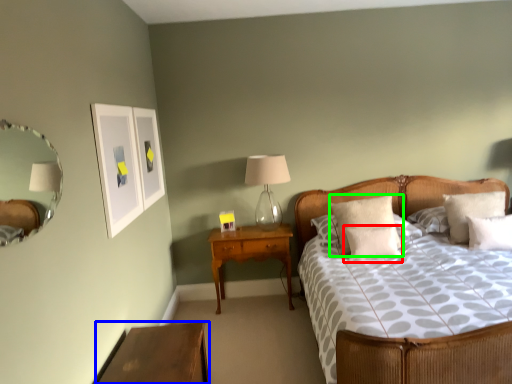
Question: Which is nearer to the pillow (highlighted by a red box)? nightstand (highlighted by a blue box) or pillow (highlighted by a green box).

Choices:
 (A) nightstand
 (B) pillow

Answer: (B)